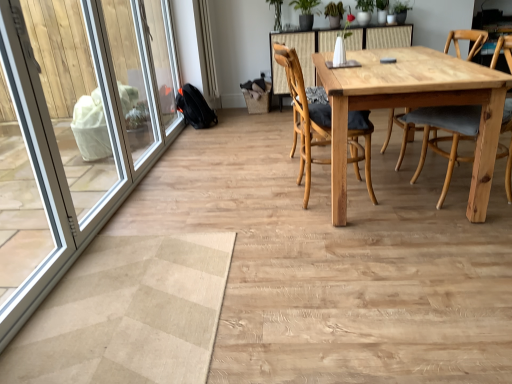
Identify the location of vacant area that lies in front of natural wood table at center. (372, 273).